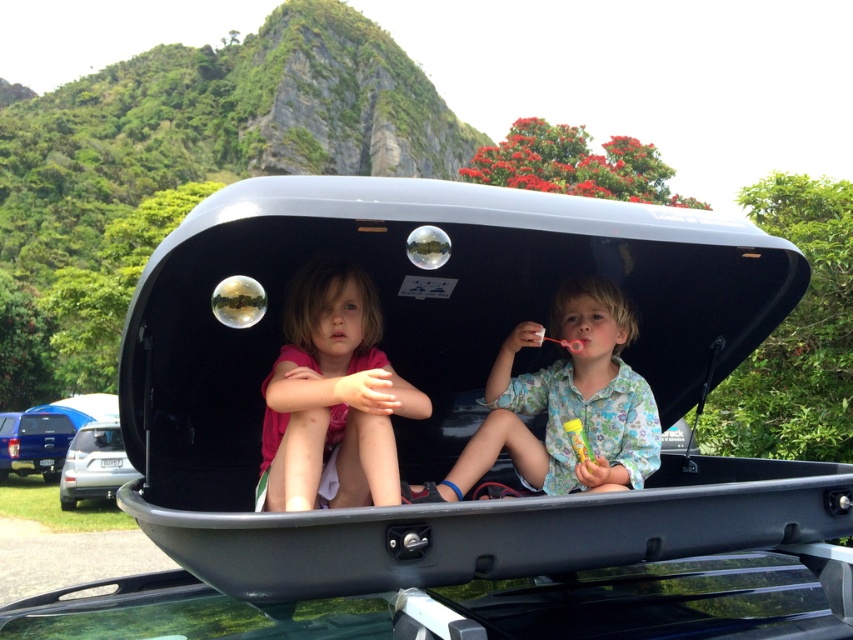
Is point (790, 584) behind point (48, 424)?

That is False.

Does matte black cargo box at center have a larger size compared to blue metallic truck at lower left?

No, matte black cargo box at center is not bigger than blue metallic truck at lower left.

Is point (814, 540) farther from camera compared to point (57, 426)?

No, (814, 540) is closer to viewer.

I want to click on matte black cargo box at center, so click(x=457, y=429).

Where is `matte black cargo box at center`? matte black cargo box at center is located at coordinates (457, 429).

Is point (785, 310) positioned behind point (543, 483)?

Yes.

Does point (741, 532) lie behind point (529, 444)?

That is False.

Where is `matte black cargo box at center`? Image resolution: width=853 pixels, height=640 pixels. matte black cargo box at center is located at coordinates (457, 429).

Which is more to the right, floral fabric shirt at center or satin silver suv at lower left?

From the viewer's perspective, floral fabric shirt at center appears more on the right side.

Which is more to the left, floral fabric shirt at center or satin silver suv at lower left?

From the viewer's perspective, satin silver suv at lower left appears more on the left side.

Does point (521, 342) come behind point (74, 435)?

No, it is not.

The width and height of the screenshot is (853, 640). I want to click on floral fabric shirt at center, so click(x=566, y=403).